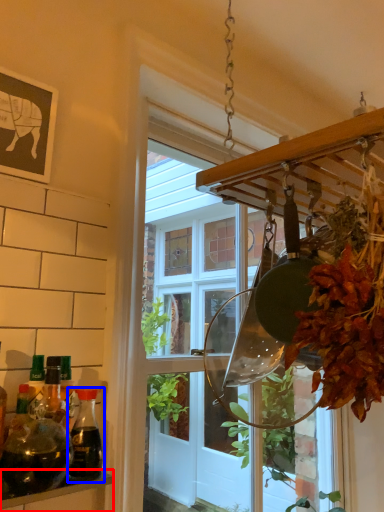
Question: Which of the following is the farthest to the observer, shelf (highlighted by a red box) or bottle (highlighted by a blue box)?

Choices:
 (A) shelf
 (B) bottle

Answer: (B)